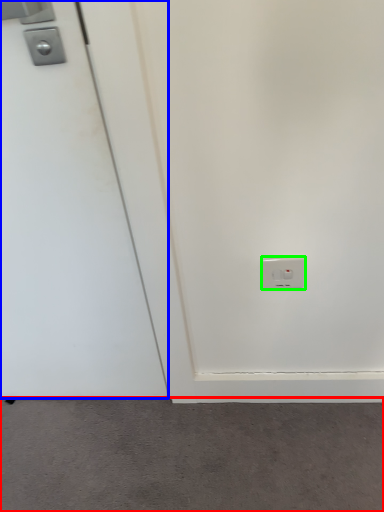
Question: Estimate the real-world distances between objects in this image. Which object is farther from concrete (highlighted by a red box), door (highlighted by a blue box) or power plugs and sockets (highlighted by a green box)?

Choices:
 (A) door
 (B) power plugs and sockets

Answer: (B)